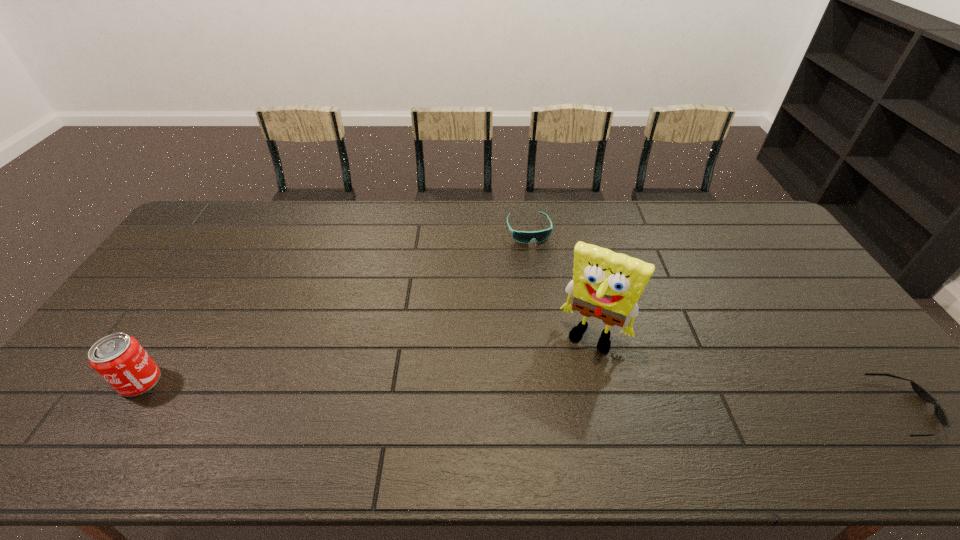
Image resolution: width=960 pixels, height=540 pixels. Find the location of `vacant area that satisfies the following two spatial constraints: 1. on the front side of the third shortest object; 2. on the front-facing side of the right sunglasses`. vacant area that satisfies the following two spatial constraints: 1. on the front side of the third shortest object; 2. on the front-facing side of the right sunglasses is located at coordinates tap(123, 408).